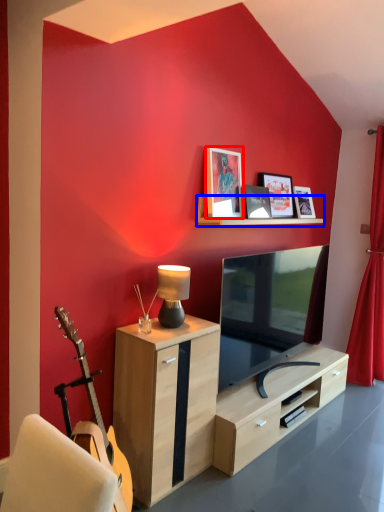
Question: Which object is further to the camera taking this photo, picture frame (highlighted by a red box) or shelf (highlighted by a blue box)?

Choices:
 (A) picture frame
 (B) shelf

Answer: (A)